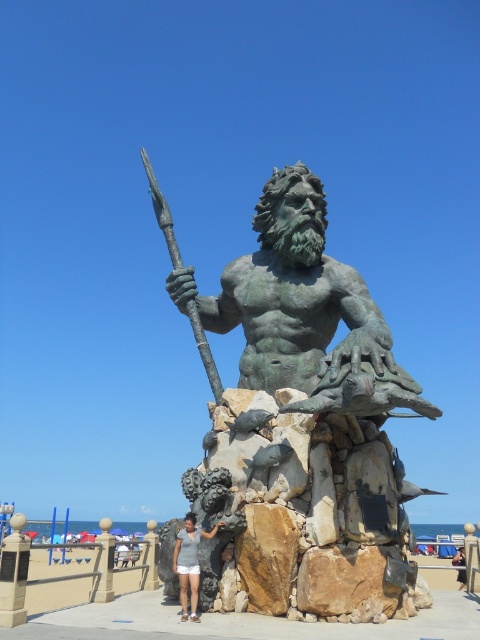
Is point (364, 444) farther from viewer compared to point (175, 561)?

Yes, it is behind point (175, 561).

Does green patina statue at center have a lesser height compared to white cotton shorts at center?

Incorrect, green patina statue at center's height does not fall short of white cotton shorts at center's.

You are a GUI agent. You are given a task and a screenshot of the screen. Output one action in this format:
    pyautogui.click(x=<x>, y=<y>)
    Task: Click on the green patina statue at center
    This screenshot has width=480, height=640.
    Given the screenshot: What is the action you would take?
    pyautogui.click(x=300, y=413)

Who is higher up, green patina statue at center or dark gray fabric shirt at center?

green patina statue at center is above.

Is green patina statue at center positioned in front of dark gray fabric shirt at center?

Yes, it is in front of dark gray fabric shirt at center.

Which is behind, point (264, 452) or point (460, 579)?

Positioned behind is point (460, 579).

The width and height of the screenshot is (480, 640). In order to click on green patina statue at center in this screenshot , I will do `click(300, 413)`.

In the scene shown: Does white cotton shorts at center appear on the left side of dark gray fabric shirt at center?

Indeed, white cotton shorts at center is positioned on the left side of dark gray fabric shirt at center.

This screenshot has height=640, width=480. In order to click on white cotton shorts at center in this screenshot , I will do `click(190, 563)`.

Find the location of a particular element. Image resolution: width=480 pixels, height=640 pixels. white cotton shorts at center is located at coordinates (190, 563).